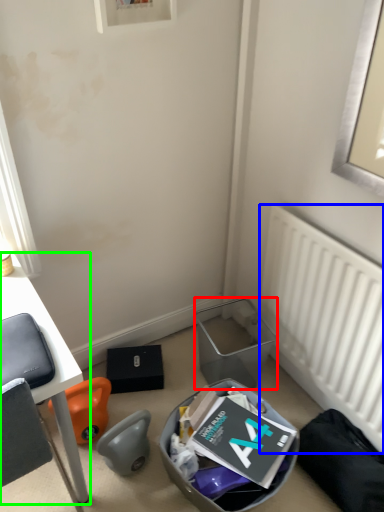
Question: Considering the real-world distances, which object is farthest from trash bin/can (highlighted by a red box)? radiator (highlighted by a blue box) or desk (highlighted by a green box)?

Choices:
 (A) radiator
 (B) desk

Answer: (B)